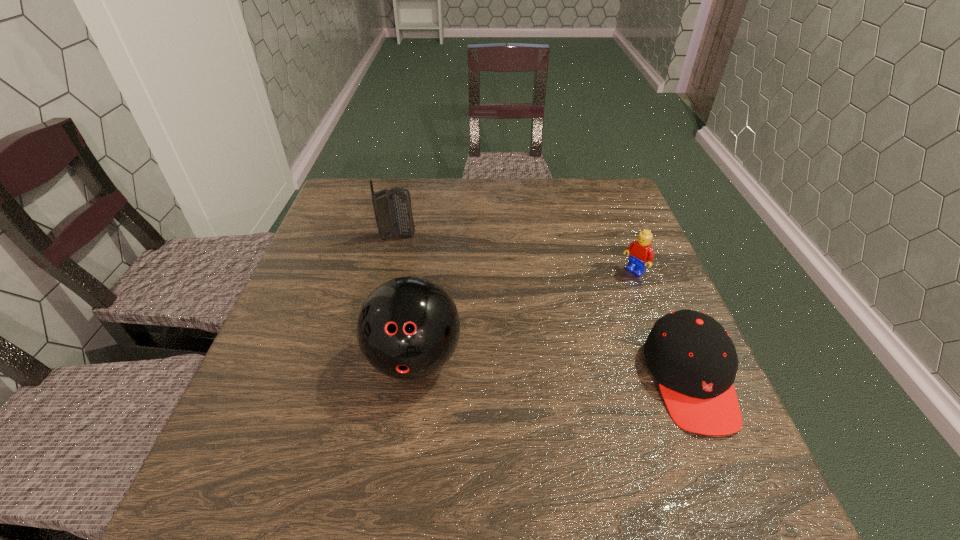
At what (x,y) coordinates should I click in order to perform the action: click on bowling ball. Please return your answer as a coordinate pair (x, y). Image resolution: width=960 pixels, height=540 pixels. Looking at the image, I should click on (407, 328).

At what (x,y) coordinates should I click in order to perform the action: click on cap. Please return your answer as a coordinate pair (x, y). The image size is (960, 540). Looking at the image, I should click on 693,358.

You are a GUI agent. You are given a task and a screenshot of the screen. Output one action in this format:
    pyautogui.click(x=<x>, y=<y>)
    Task: Click on the cellular telephone
    Image resolution: width=960 pixels, height=540 pixels.
    Given the screenshot: What is the action you would take?
    pyautogui.click(x=393, y=213)

Locate an element on the screen. Lego is located at coordinates (640, 252).

Find the location of a particular element. This screenshot has width=960, height=540. vacant space situated on the surface of the bowling ball near the finger holes is located at coordinates (403, 442).

Where is `free space located 0.270m on the keyboard of the farthest object`? The width and height of the screenshot is (960, 540). free space located 0.270m on the keyboard of the farthest object is located at coordinates (472, 293).

I want to click on blank space located 0.130m on the keyboard of the farthest object, so click(x=437, y=264).

You are a GUI agent. You are given a task and a screenshot of the screen. Output one action in this format:
    pyautogui.click(x=<x>, y=<y>)
    Task: Click on the vacant space situated 0.390m on the keyboard of the farthest object
    This screenshot has height=540, width=960.
    Given the screenshot: What is the action you would take?
    pyautogui.click(x=508, y=322)

I want to click on vacant space positioned 0.120m on the front-facing side of the third nearest object, so click(x=596, y=301).

At what (x,y) coordinates should I click in order to perform the action: click on vacant area situated on the front-facing side of the third nearest object. Please return your answer as a coordinate pair (x, y). Looking at the image, I should click on (527, 354).